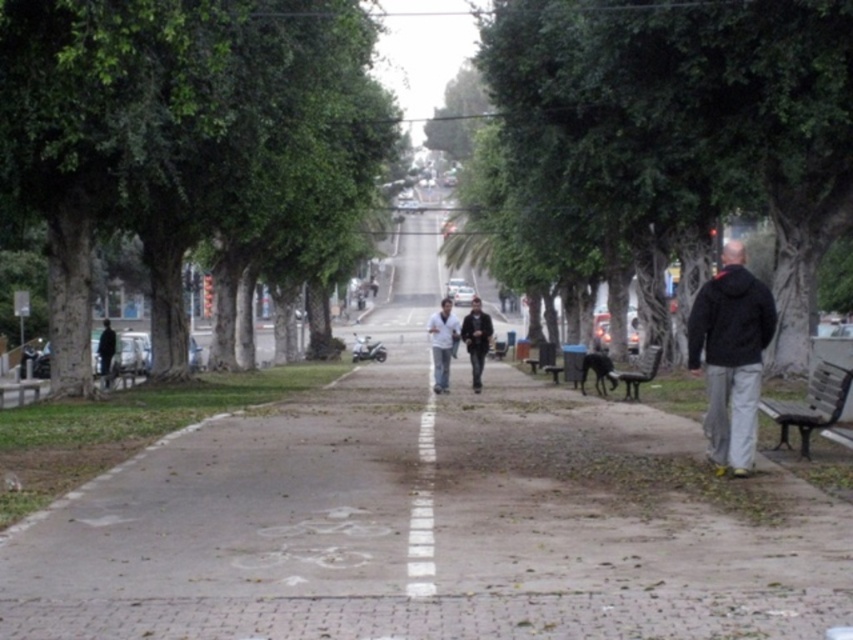
You are a park visitor who wants to sit on the metallic silver bench at lower right. There is a person wearing a dark gray jacket at center in your way. Which direction should you move to reach the bench without disturbing them?

You should move to the right side of the dark gray jacket at center to reach the metallic silver bench at lower right since the jacket is to the left of the bench.

You are a delivery person carrying a large box that is 1.2 meters wide. You need to walk along the pathway and pass between the dark gray jacket at center and the metallic silver bench at lower right. Can your box fit through the space between them without touching either?

The dark gray jacket at center is narrower than the metallic silver bench at lower right. However, the exact distance between them isn